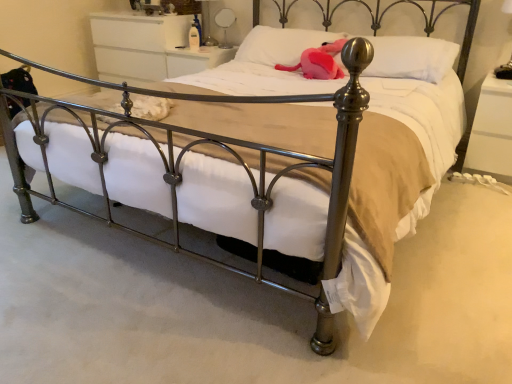
Question: Do you think white glossy dresser at upper center, positioned as the 1th nightstand in left-to-right order, is within pink plush toy at center, or outside of it?

Choices:
 (A) inside
 (B) outside

Answer: (B)

Question: Considering the positions of point (150, 69) and point (313, 67), is point (150, 69) closer or farther from the camera than point (313, 67)?

Choices:
 (A) farther
 (B) closer

Answer: (A)

Question: Which of these objects is positioned farthest from the pink plush toy at center?

Choices:
 (A) metallic silver table lamp at upper right, positioned as the 2th table lamp in left-to-right order
 (B) white glossy nightstand at right, positioned as the second nightstand in back-to-front order
 (C) metallic silver table lamp at upper center, the 2th table lamp in the bottom-to-top sequence
 (D) white soft pillow at upper center, which is counted as the second pillow, starting from the left
 (E) white glossy dresser at upper center, which is counted as the second nightstand, starting from the bottom

Answer: (C)

Question: Which of these objects is positioned farthest from the metallic silver table lamp at upper center, arranged as the 1th table lamp when viewed from the top?

Choices:
 (A) white glossy nightstand at right, which ranks as the first nightstand in right-to-left order
 (B) white soft pillow at upper center, which is counted as the second pillow, starting from the left
 (C) metallic silver table lamp at upper right, positioned as the 2th table lamp in left-to-right order
 (D) pink plush toy at center
 (E) white soft pillow at upper center, which is counted as the 2th pillow, starting from the right

Answer: (C)